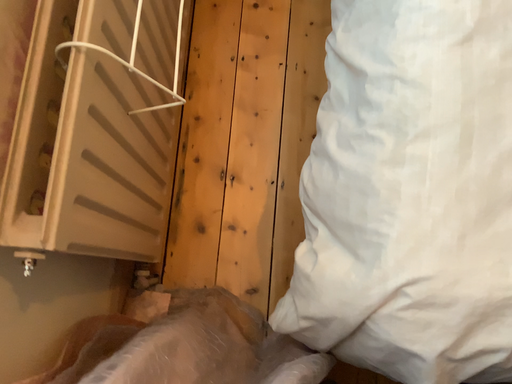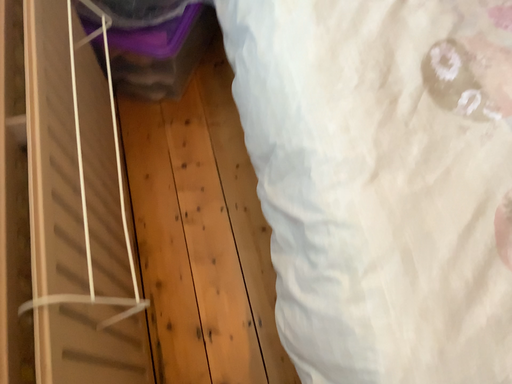
Question: How did the camera likely rotate when shooting the video?

Choices:
 (A) rotated downward
 (B) rotated upward

Answer: (B)